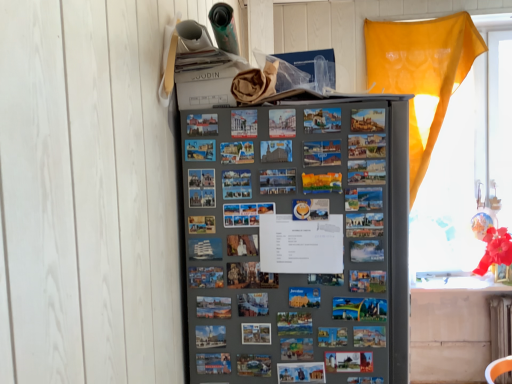
Question: Should I look upward or downward to see white painted metal radiator at lower right?

Choices:
 (A) up
 (B) down

Answer: (B)

Question: Considering the relative sizes of white painted metal radiator at lower right and metallic gray refrigerator at center in the image provided, is white painted metal radiator at lower right bigger than metallic gray refrigerator at center?

Choices:
 (A) no
 (B) yes

Answer: (A)

Question: Is metallic gray refrigerator at center a part of white painted metal radiator at lower right?

Choices:
 (A) no
 (B) yes

Answer: (A)

Question: Is white painted metal radiator at lower right aimed at metallic gray refrigerator at center?

Choices:
 (A) no
 (B) yes

Answer: (A)

Question: Is white painted metal radiator at lower right taller than metallic gray refrigerator at center?

Choices:
 (A) no
 (B) yes

Answer: (A)

Question: Considering the relative positions of white painted metal radiator at lower right and metallic gray refrigerator at center in the image provided, is white painted metal radiator at lower right to the right of metallic gray refrigerator at center from the viewer's perspective?

Choices:
 (A) no
 (B) yes

Answer: (B)

Question: Is the position of white painted metal radiator at lower right less distant than that of metallic gray refrigerator at center?

Choices:
 (A) yes
 (B) no

Answer: (B)

Question: Can you confirm if metallic gray refrigerator at center is bigger than translucent yellow curtain at right?

Choices:
 (A) yes
 (B) no

Answer: (A)

Question: From the image's perspective, is metallic gray refrigerator at center on translucent yellow curtain at right?

Choices:
 (A) no
 (B) yes

Answer: (A)

Question: Considering the relative sizes of metallic gray refrigerator at center and translucent yellow curtain at right in the image provided, is metallic gray refrigerator at center smaller than translucent yellow curtain at right?

Choices:
 (A) no
 (B) yes

Answer: (A)

Question: Is metallic gray refrigerator at center wider than translucent yellow curtain at right?

Choices:
 (A) yes
 (B) no

Answer: (A)

Question: From a real-world perspective, is metallic gray refrigerator at center located beneath translucent yellow curtain at right?

Choices:
 (A) yes
 (B) no

Answer: (A)

Question: Considering the relative positions of metallic gray refrigerator at center and translucent yellow curtain at right in the image provided, is metallic gray refrigerator at center to the right of translucent yellow curtain at right from the viewer's perspective?

Choices:
 (A) no
 (B) yes

Answer: (A)

Question: Is translucent yellow curtain at right taller than white painted metal radiator at lower right?

Choices:
 (A) no
 (B) yes

Answer: (B)